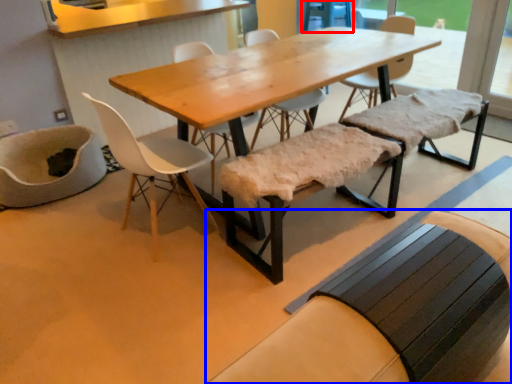
Question: Which point is closer to the camera, armchair (highlighted by a red box) or church bench (highlighted by a blue box)?

Choices:
 (A) armchair
 (B) church bench

Answer: (B)